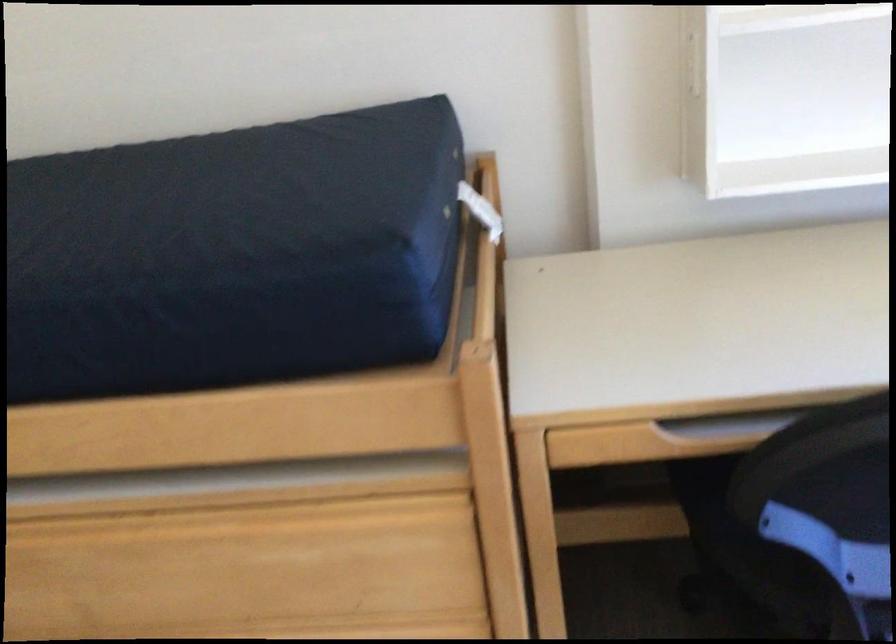
Where would you lift the blue wedge pillow? Please return your answer as a coordinate pair (x, y).

(243, 221)